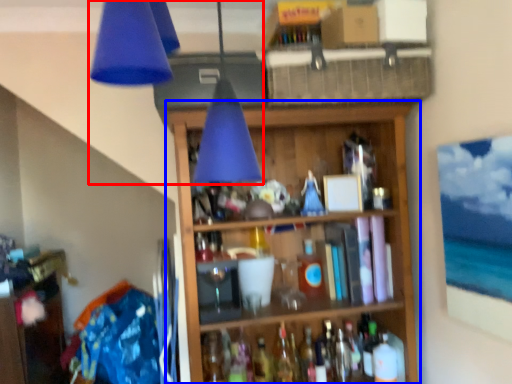
Question: Which point is further to the camera, lamp (highlighted by a red box) or shelf (highlighted by a blue box)?

Choices:
 (A) lamp
 (B) shelf

Answer: (B)